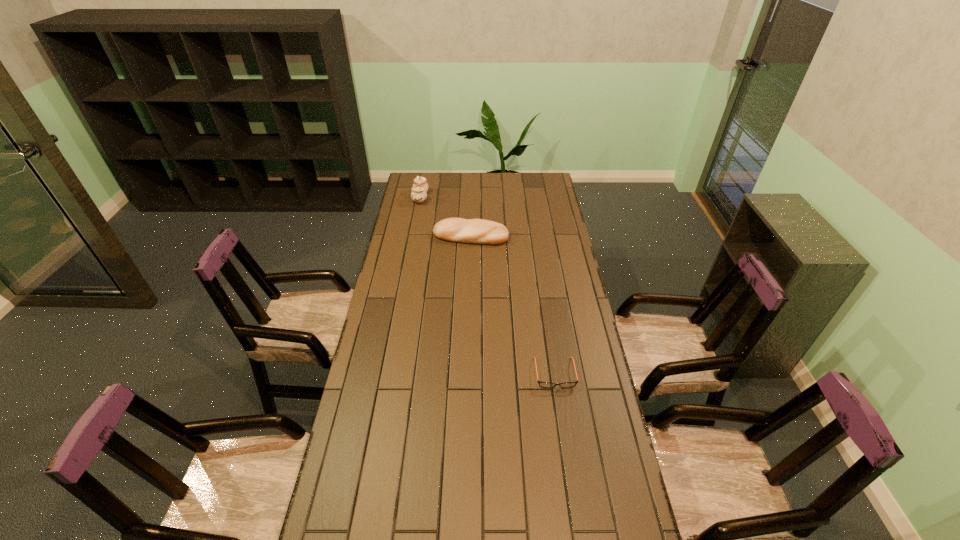
Locate an element on the screen. vacant area that lies between the shortest object and the second object from left to right is located at coordinates (513, 305).

Where is `vacant point located between the second farthest object and the nearest object`? Image resolution: width=960 pixels, height=540 pixels. vacant point located between the second farthest object and the nearest object is located at coordinates (513, 305).

Image resolution: width=960 pixels, height=540 pixels. I want to click on free spot between the rightmost object and the tallest object, so click(488, 285).

You are a GUI agent. You are given a task and a screenshot of the screen. Output one action in this format:
    pyautogui.click(x=<x>, y=<y>)
    Task: Click on the object that can be found as the closest to the farthest object
    
    Given the screenshot: What is the action you would take?
    pyautogui.click(x=474, y=231)

Identify which object is the nearest to the second tallest object. Please provide its 2D coordinates. Your answer should be formatted as a tuple, i.e. [(x, y)], where the tuple contains the x and y coordinates of a point satisfying the conditions above.

[(420, 186)]

What are the coordinates of `blank space that satisfies the following two spatial constraints: 1. by the handle of the farthest object; 2. on the back side of the second farthest object` in the screenshot? It's located at (413, 236).

The width and height of the screenshot is (960, 540). In order to click on vacant space that satisfies the following two spatial constraints: 1. on the back side of the second tallest object; 2. by the handle of the chinaware in this screenshot , I will do `click(471, 198)`.

Identify the location of blank space that satisfies the following two spatial constraints: 1. by the handle of the second nearest object; 2. on the left side of the farthest object. (413, 236).

Identify the location of free space that satisfies the following two spatial constraints: 1. by the handle of the chinaware; 2. on the left side of the second farthest object. This screenshot has height=540, width=960. (413, 236).